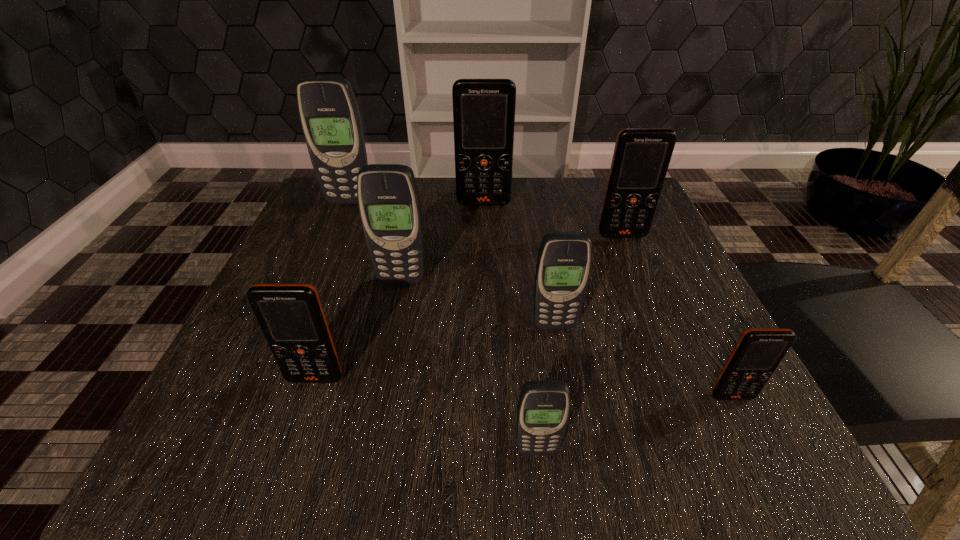
Where is `the second closest object to the second farthest orange cellular telephone`? the second closest object to the second farthest orange cellular telephone is located at coordinates (564, 260).

This screenshot has width=960, height=540. I want to click on object that is the fourth closest to the leftmost gray cellular telephone, so click(564, 260).

Locate which cellular telephone is the sixth closest to the fourth farthest cellular telephone. Please provide its 2D coordinates. Your answer should be formatted as a tuple, i.e. [(x, y)], where the tuple contains the x and y coordinates of a point satisfying the conditions above.

[(641, 158)]

The image size is (960, 540). I want to click on cellular telephone that can be found as the fifth closest to the farthest orange cellular telephone, so click(x=291, y=317).

Choose which orange cellular telephone is the fourth nearest neighbor to the fifth nearest object. Please provide its 2D coordinates. Your answer should be formatted as a tuple, i.e. [(x, y)], where the tuple contains the x and y coordinates of a point satisfying the conditions above.

[(758, 352)]

At what (x,y) coordinates should I click in order to perform the action: click on orange cellular telephone that is the third closest to the nearest orange cellular telephone. Please return your answer as a coordinate pair (x, y). The height and width of the screenshot is (540, 960). Looking at the image, I should click on (483, 109).

Choose which gray cellular telephone is the third nearest neighbor to the biggest orange cellular telephone. Please provide its 2D coordinates. Your answer should be formatted as a tuple, i.e. [(x, y)], where the tuple contains the x and y coordinates of a point satisfying the conditions above.

[(564, 260)]

This screenshot has height=540, width=960. Find the location of `gray cellular telephone that is the closest to the leftmost gray cellular telephone`. gray cellular telephone that is the closest to the leftmost gray cellular telephone is located at coordinates (x=388, y=198).